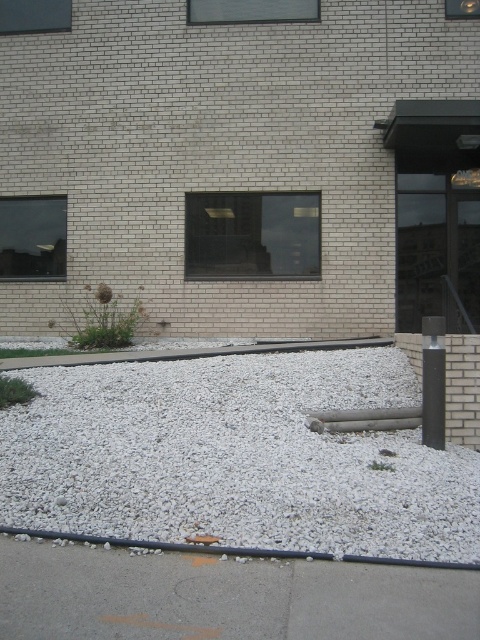
Does black rubber curb at lower center have a lesser height compared to black polished pole at right?

Correct, black rubber curb at lower center is not as tall as black polished pole at right.

Is point (272, 548) more distant than point (431, 388)?

That is False.

Where is `black rubber curb at lower center`? This screenshot has height=640, width=480. black rubber curb at lower center is located at coordinates (170, 545).

Between gray concrete sidewalk at lower left and black polished pole at right, which one is positioned lower?

gray concrete sidewalk at lower left is lower down.

Identify the location of gray concrete sidewalk at lower left. (225, 596).

Can you confirm if white gravel at lower center is bigger than gray concrete sidewalk at lower left?

Yes.

Is point (134, 401) closer to camera compared to point (159, 634)?

No, (134, 401) is behind (159, 634).

Between point (92, 465) and point (26, 620), which one is positioned in front?

Point (26, 620) is in front.

Identify the location of white gravel at lower center. This screenshot has height=640, width=480. (237, 456).